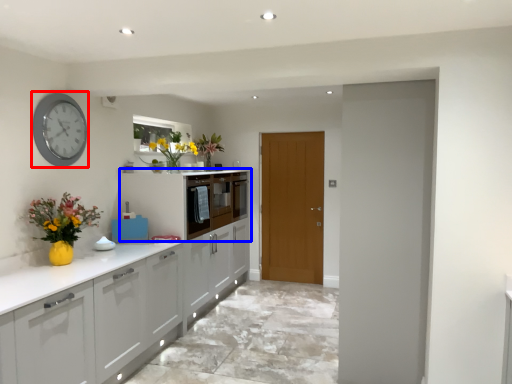
Question: Which point is further to the camera, clock (highlighted by a red box) or cabinetry (highlighted by a blue box)?

Choices:
 (A) clock
 (B) cabinetry

Answer: (B)